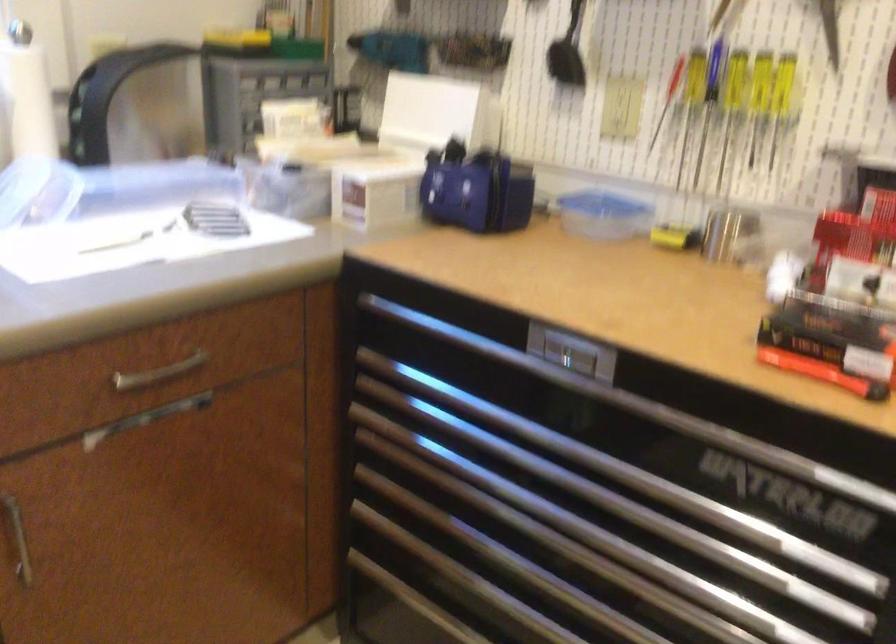
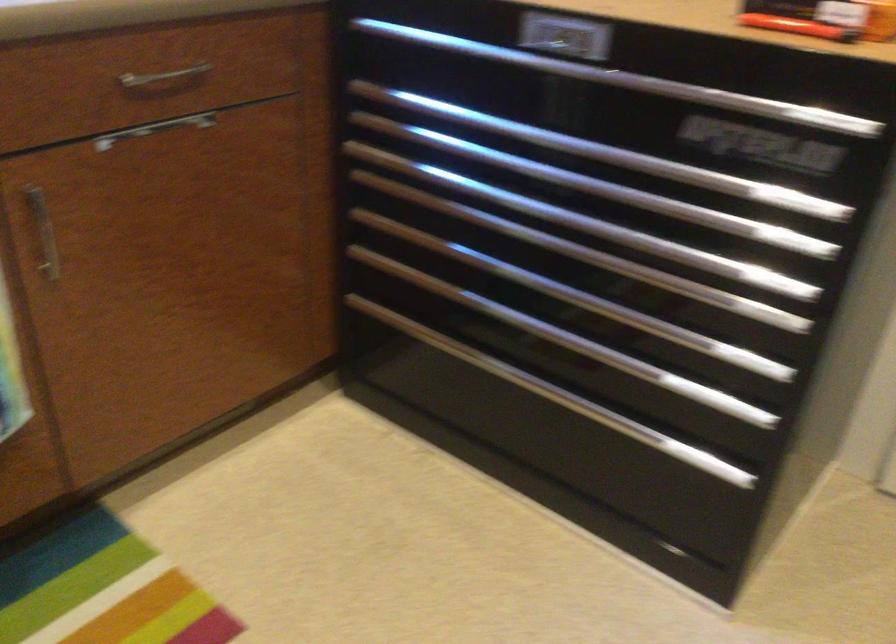
Find the pixel in the second image that matches (x=686, y=536) in the first image.

(666, 205)